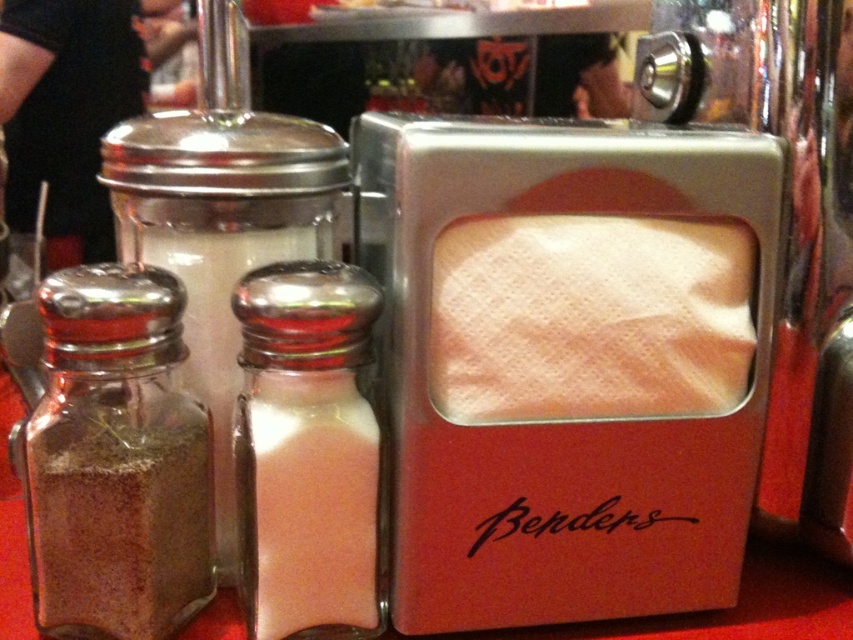
You are a diner trying to grab the pink glass salt shaker at center. There is a brown powder at left on the table. Which one is larger in size?

The brown powder at left is bigger than the pink glass salt shaker at center, so the brown powder at left is larger in size.

You are a diner who wants to reach for the brown powder at left but needs to place your hand on the white paper napkin at center first. Can you do this without moving your arm more than 7 inches?

The white paper napkin at center is 6.75 inches away from the brown powder at left, so yes, you can reach the brown powder at left from the white paper napkin at center without moving your arm more than 7 inches since the distance is within the limit.